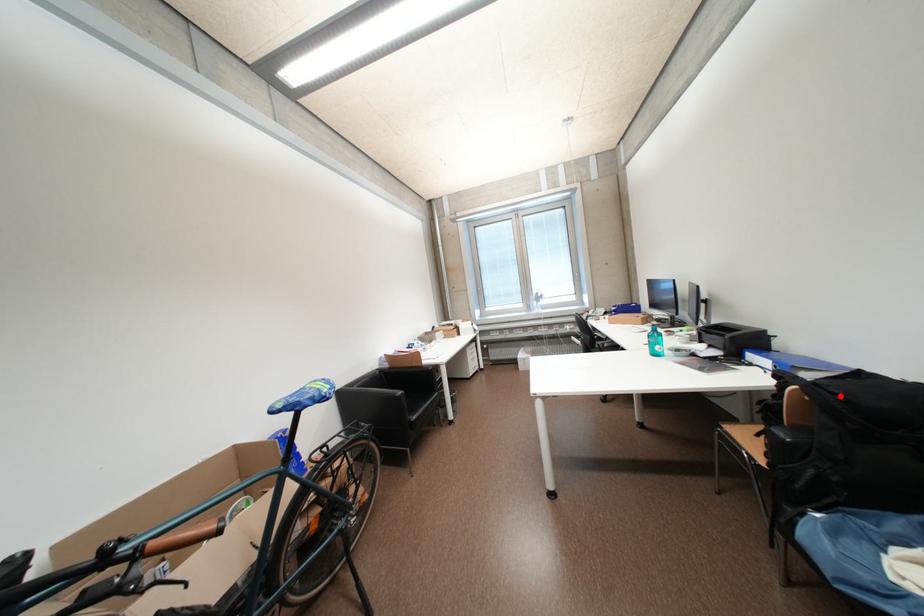
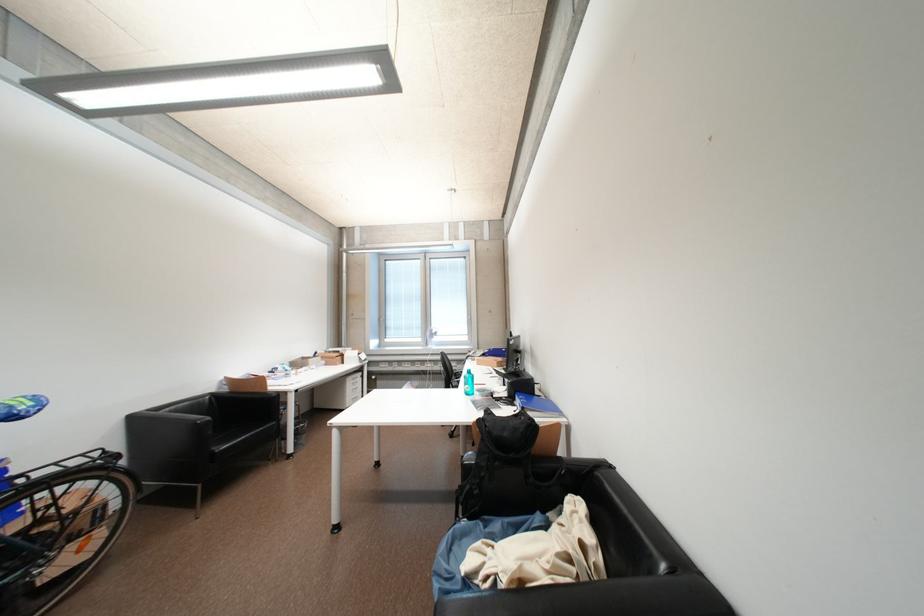
In the second image, find the point that corresponds to the highlighted location in the first image.

(493, 428)